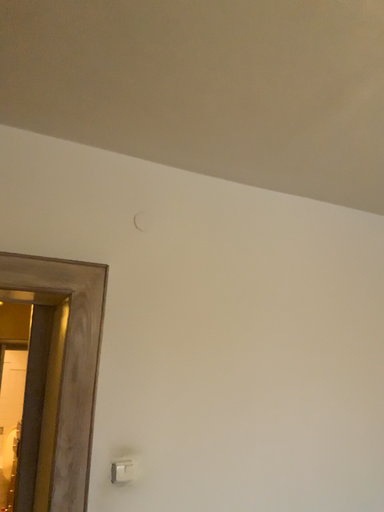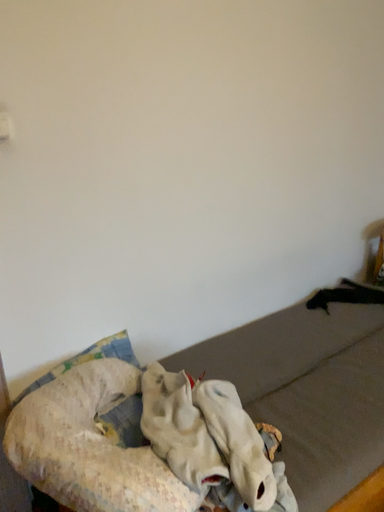
Question: Which way did the camera rotate in the video?

Choices:
 (A) rotated upward
 (B) rotated downward

Answer: (B)